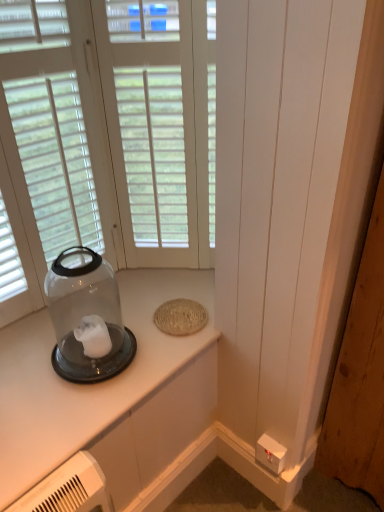
In order to click on free space above clear glass jar at left (from a real-world perspective) in this screenshot , I will do `click(119, 327)`.